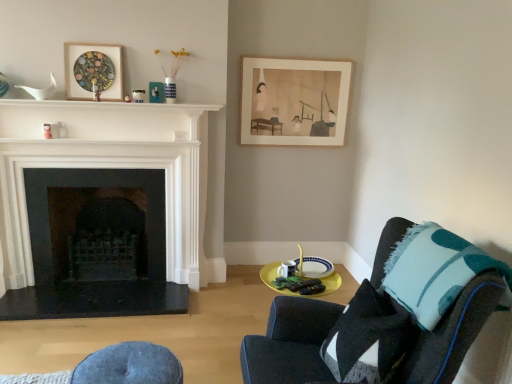
Question: From the image's perspective, is denim cushion at lower center above or below matte black picture frame at upper center, arranged as the second picture frame when viewed from the front?

Choices:
 (A) above
 (B) below

Answer: (B)

Question: Considering the positions of point (117, 375) and point (163, 99), is point (117, 375) closer or farther from the camera than point (163, 99)?

Choices:
 (A) closer
 (B) farther

Answer: (A)

Question: Based on their relative distances, which object is farther from the denim cushion at lower center?

Choices:
 (A) white glossy mantle at upper center
 (B) matte black picture frame at upper center, acting as the 2th picture frame starting from the back
 (C) white glossy fireplace at left, the second fireplace from the back
 (D) teal felt throw pillow at right
 (E) white ceramic plate at lower center

Answer: (B)

Question: Estimate the real-world distances between objects in this image. Which object is farther from the white glossy fireplace at left, the second fireplace from the back?

Choices:
 (A) white ceramic plate at lower center
 (B) black stone fireplace at left, marked as the 2th fireplace in a front-to-back arrangement
 (C) matte black picture frame at upper center, which is the second picture frame from left to right
 (D) matte paper picture frame at upper center, the 3th picture frame when ordered from front to back
 (E) dark blue fabric chair at lower right

Answer: (E)